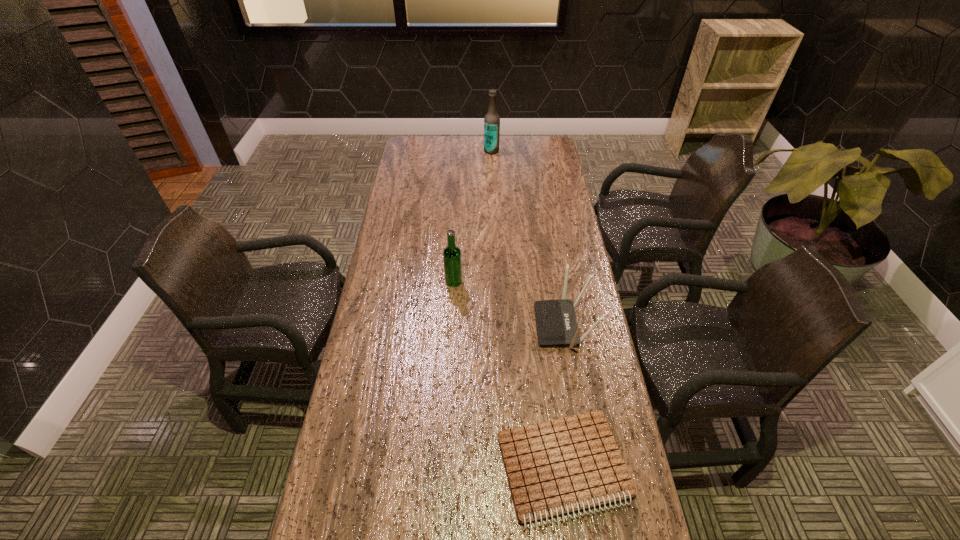
At what (x,y) coordinates should I click in order to perform the action: click on the farther beer bottle. Please return your answer as a coordinate pair (x, y). The image size is (960, 540). Looking at the image, I should click on click(x=492, y=120).

Find the location of `the tallest object`. the tallest object is located at coordinates (492, 120).

Locate an element on the screen. the leftmost object is located at coordinates (452, 258).

Image resolution: width=960 pixels, height=540 pixels. Find the location of `the left beer bottle`. the left beer bottle is located at coordinates 452,258.

Locate an element on the screen. The image size is (960, 540). the second shortest object is located at coordinates (556, 322).

At what (x,y) coordinates should I click in order to perform the action: click on router. Please return your answer as a coordinate pair (x, y). Looking at the image, I should click on (556, 322).

In order to click on notebook in this screenshot , I will do `click(572, 463)`.

Locate an element on the screen. The image size is (960, 540). the shortest object is located at coordinates (572, 463).

Locate an element on the screen. This screenshot has width=960, height=540. free space located on the side of the farthest object with the label is located at coordinates (457, 151).

This screenshot has width=960, height=540. In order to click on vacant space located 0.380m on the side of the farthest object with the label in this screenshot , I will do `click(406, 151)`.